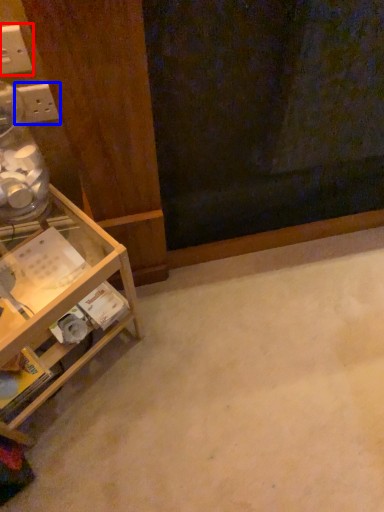
Question: Which object is closer to the camera taking this photo, electric outlet (highlighted by a red box) or electric outlet (highlighted by a blue box)?

Choices:
 (A) electric outlet
 (B) electric outlet

Answer: (A)